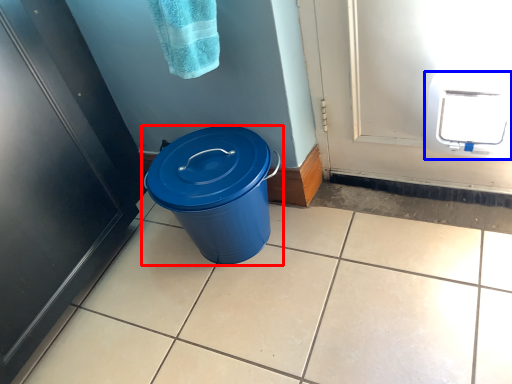
Question: Which object appears farthest to the camera in this image, waste container (highlighted by a red box) or appliance (highlighted by a blue box)?

Choices:
 (A) waste container
 (B) appliance

Answer: (A)